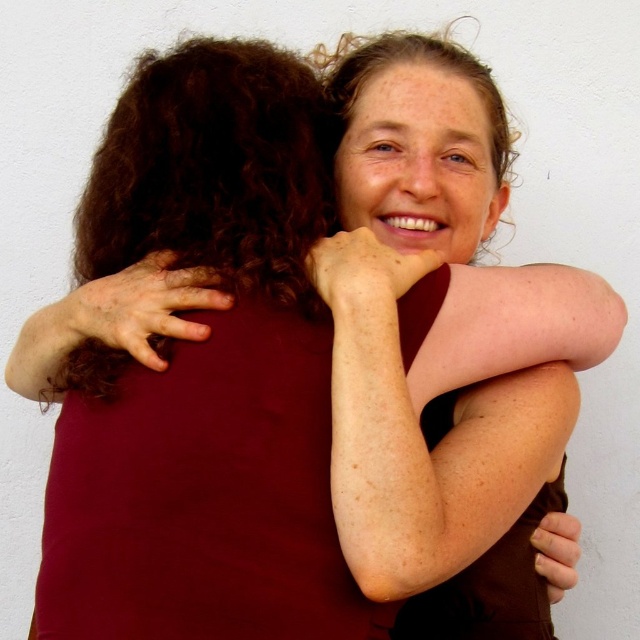
Question: Among these objects, which one is nearest to the camera?

Choices:
 (A) dry skin at left
 (B) smooth skin arm at center

Answer: (B)

Question: Which of the following is the farthest from the observer?

Choices:
 (A) (198, 305)
 (B) (508, 428)

Answer: (B)

Question: Is smooth skin arm at center positioned in front of dry skin at left?

Choices:
 (A) yes
 (B) no

Answer: (A)

Question: Is smooth skin arm at center below dry skin at left?

Choices:
 (A) yes
 (B) no

Answer: (A)

Question: Can you confirm if smooth skin arm at center is thinner than dry skin at left?

Choices:
 (A) yes
 (B) no

Answer: (A)